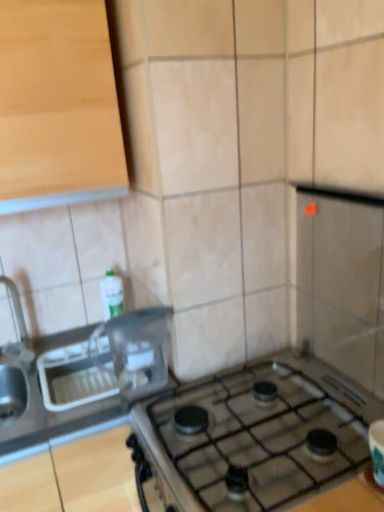
Question: From a real-world perspective, is brushed metal faucet at left physically above satin silver sink at left?

Choices:
 (A) yes
 (B) no

Answer: (A)

Question: Could you tell me if brushed metal faucet at left is facing satin silver sink at left?

Choices:
 (A) no
 (B) yes

Answer: (A)

Question: Is brushed metal faucet at left far away from satin silver sink at left?

Choices:
 (A) yes
 (B) no

Answer: (B)

Question: From the image's perspective, is brushed metal faucet at left located beneath satin silver sink at left?

Choices:
 (A) no
 (B) yes

Answer: (A)

Question: From the image's perspective, is brushed metal faucet at left above satin silver sink at left?

Choices:
 (A) no
 (B) yes

Answer: (B)

Question: Based on their sizes in the image, would you say clear plastic container at center is bigger or smaller than light wood cabinet at upper left?

Choices:
 (A) small
 (B) big

Answer: (A)

Question: Considering the positions of clear plastic container at center and light wood cabinet at upper left in the image, is clear plastic container at center taller or shorter than light wood cabinet at upper left?

Choices:
 (A) short
 (B) tall

Answer: (A)

Question: Based on their positions, is clear plastic container at center located to the left or right of light wood cabinet at upper left?

Choices:
 (A) left
 (B) right

Answer: (B)

Question: Is point (122, 373) positioned closer to the camera than point (84, 196)?

Choices:
 (A) closer
 (B) farther

Answer: (B)

Question: In terms of width, does satin silver sink at left look wider or thinner when compared to brushed metal faucet at left?

Choices:
 (A) wide
 (B) thin

Answer: (A)

Question: Which is correct: satin silver sink at left is inside brushed metal faucet at left, or outside of it?

Choices:
 (A) outside
 (B) inside

Answer: (A)

Question: Would you say satin silver sink at left is to the left or to the right of brushed metal faucet at left in the picture?

Choices:
 (A) right
 (B) left

Answer: (A)

Question: In the image, is satin silver sink at left positioned in front of or behind brushed metal faucet at left?

Choices:
 (A) front
 (B) behind

Answer: (A)

Question: Is light wood cabinet at upper left bigger or smaller than satin silver sink at left?

Choices:
 (A) big
 (B) small

Answer: (A)

Question: Is point (x=62, y=71) closer or farther from the camera than point (x=23, y=389)?

Choices:
 (A) closer
 (B) farther

Answer: (A)